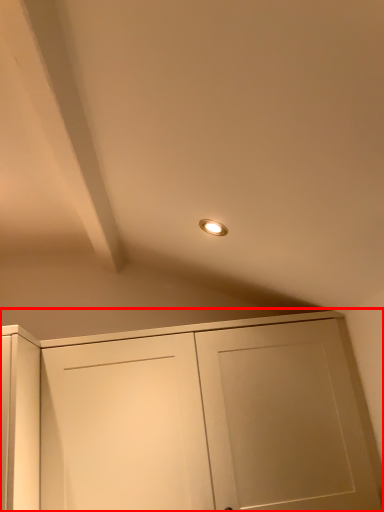
Question: Where is cupboard (annotated by the red box) located in relation to exhaust hood in the image?

Choices:
 (A) left
 (B) right

Answer: (B)